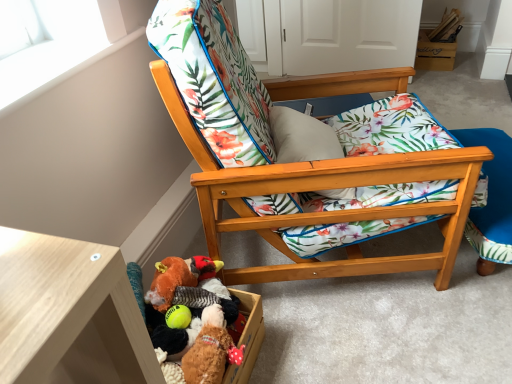
Question: Is point (468, 233) closer or farther from the camera than point (201, 344)?

Choices:
 (A) farther
 (B) closer

Answer: (A)

Question: From the image's perspective, is wooden folding chair at lower right above or below fluffy brown teddy bear at lower center, the 1th toy viewed from the front?

Choices:
 (A) above
 (B) below

Answer: (A)

Question: Estimate the real-world distances between objects in this image. Which object is farther from the fluffy brown teddy bear at lower center, the 1th toy viewed from the front?

Choices:
 (A) fluffy fabric stuffed animal at lower left, the 2th toy viewed from the front
 (B) white matte window screen at upper left
 (C) wooden folding chair at lower right
 (D) wooden chair with floral cushion at center
 (E) wooden box at upper right

Answer: (E)

Question: Which of these objects is positioned farthest from the fluffy fabric stuffed animal at lower left, positioned as the first toy in back-to-front order?

Choices:
 (A) wooden box at upper right
 (B) wooden folding chair at lower right
 (C) fluffy brown teddy bear at lower center, the 1th toy viewed from the front
 (D) white matte window screen at upper left
 (E) wooden chair with floral cushion at center

Answer: (A)